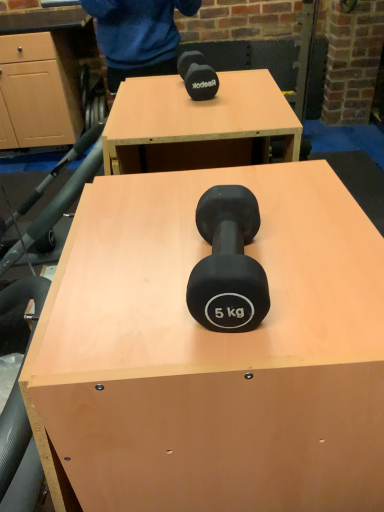
Identify the location of vacant space situated on the left part of black rubber dumbbell at center. Image resolution: width=384 pixels, height=512 pixels. (118, 285).